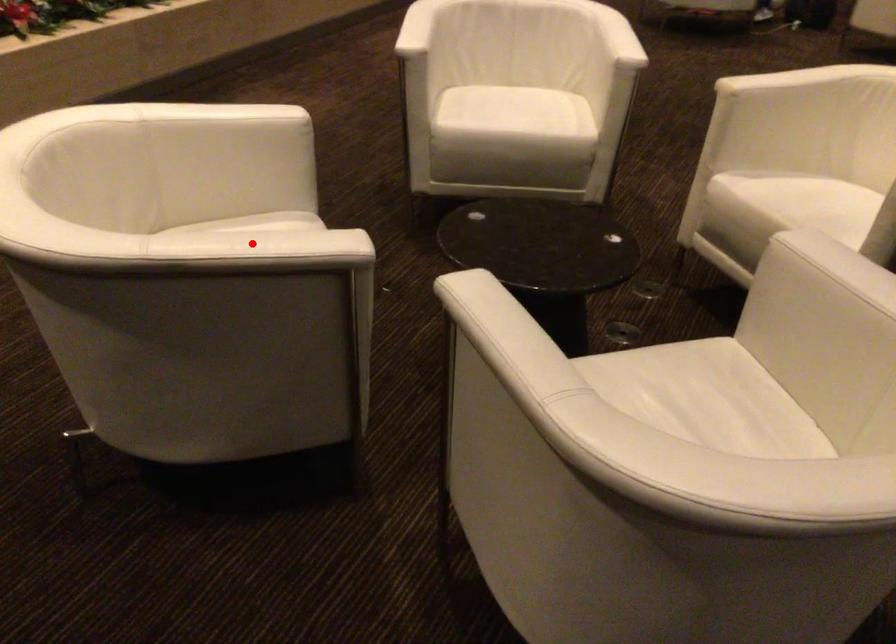
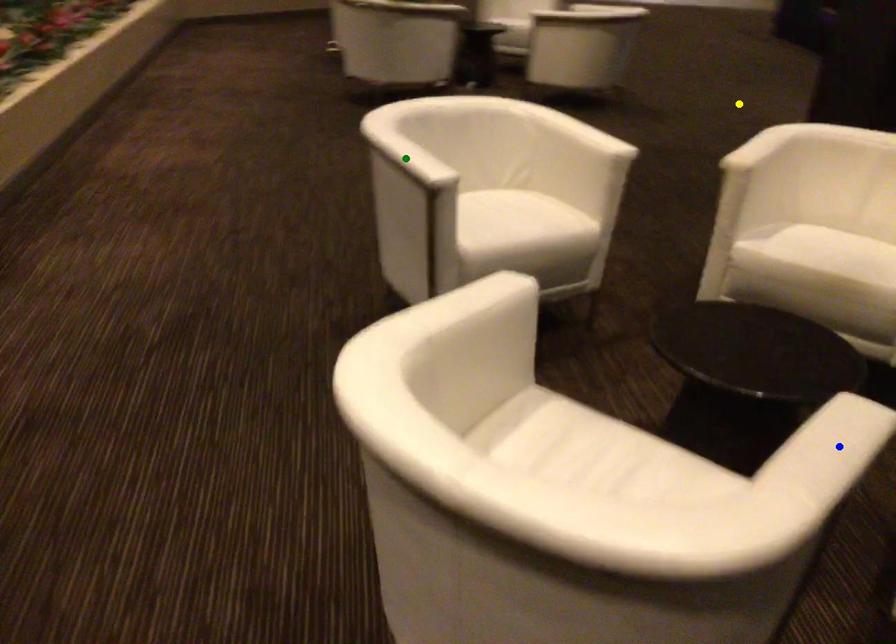
Question: I am providing you with two images of the same scene from different viewpoints. A red point is marked on the first image. You are given multiple points on the second image. Which spot in image 2 lines up with the point in image 1?

Choices:
 (A) green point
 (B) blue point
 (C) yellow point

Answer: (B)